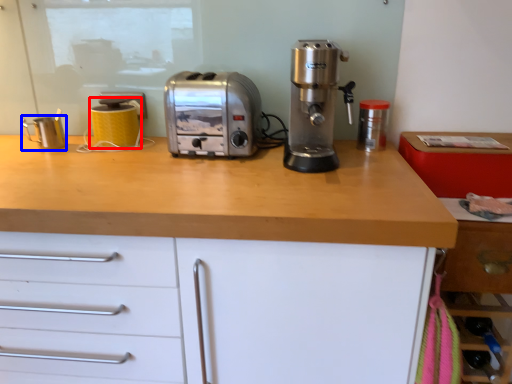
Question: Which point is closer to the camera, kitchen appliance (highlighted by a red box) or kitchen appliance (highlighted by a blue box)?

Choices:
 (A) kitchen appliance
 (B) kitchen appliance

Answer: (B)